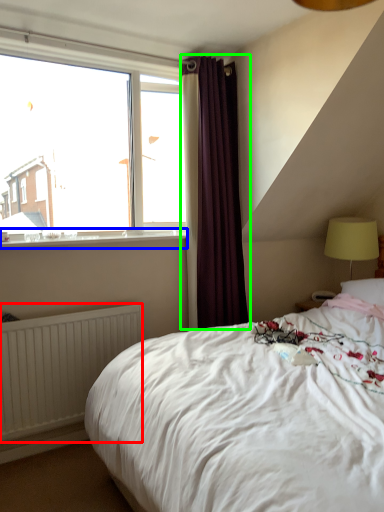
Question: Which is farther away from radiator (highlighted by a red box)? window sill (highlighted by a blue box) or curtain (highlighted by a green box)?

Choices:
 (A) window sill
 (B) curtain

Answer: (B)